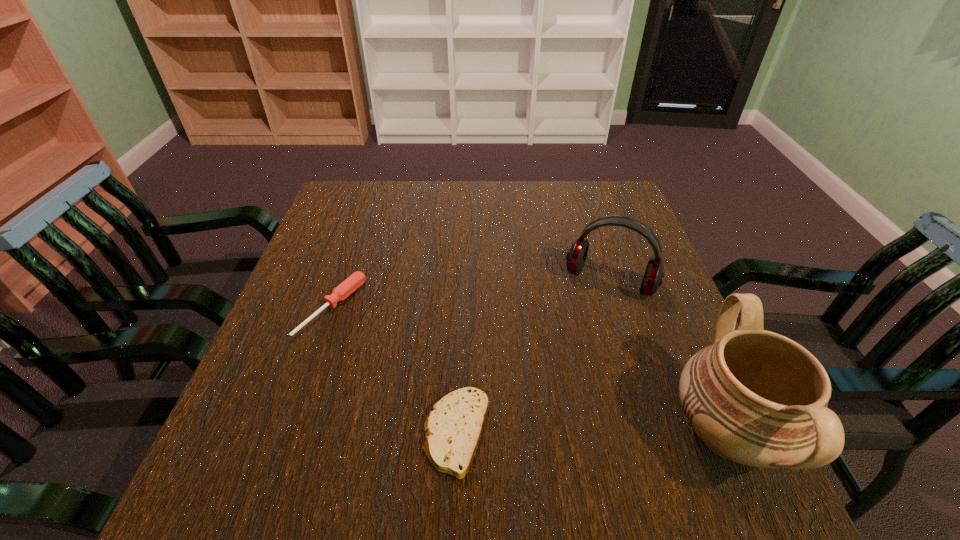
At what (x,y) coordinates should I click in order to perform the action: click on vacant space on the desktop that is between the pita bread and the urn and is positioned on the ear cups of the earphone. Please return your answer as a coordinate pair (x, y). Looking at the image, I should click on (554, 433).

Identify the location of vacant space on the desktop that is between the third object from right to left and the tallest object and is positioned at the blade of the third tallest object. This screenshot has width=960, height=540. (579, 433).